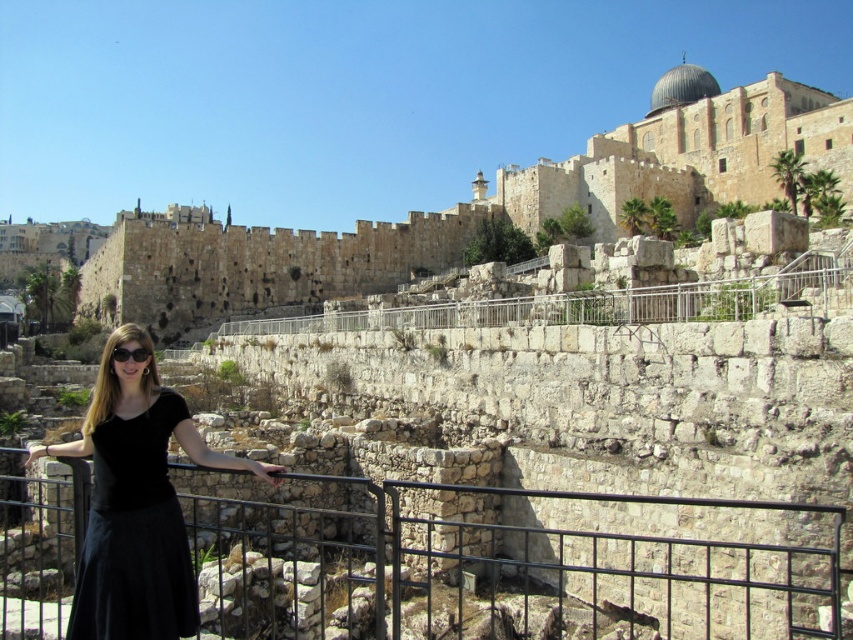
Measure the distance between point (506, 556) and camera.

Point (506, 556) and camera are 45.68 meters apart from each other.

Who is more forward, (328, 636) or (113, 525)?

Point (113, 525)

Who is more distant from viewer, (302, 609) or (273, 467)?

Point (302, 609)

The height and width of the screenshot is (640, 853). In order to click on black metal fence at center in this screenshot , I will do `click(503, 561)`.

Which is more to the left, black velvet dress at center or black plastic goggles at center?

Positioned to the left is black plastic goggles at center.

Between black velvet dress at center and black plastic goggles at center, which one is positioned higher?

Positioned higher is black plastic goggles at center.

Measure the distance between point [192,582] and camera.

Point [192,582] and camera are 92.68 feet apart.

The height and width of the screenshot is (640, 853). I want to click on black velvet dress at center, so click(x=135, y=534).

Between black metal fence at center and black velvet dress at center, which one is positioned higher?

black velvet dress at center is higher up.

Is black metal fence at center shorter than black velvet dress at center?

No, black metal fence at center is not shorter than black velvet dress at center.

You are a GUI agent. You are given a task and a screenshot of the screen. Output one action in this format:
    pyautogui.click(x=<x>, y=<y>)
    Task: Click on the black metal fence at center
    
    Given the screenshot: What is the action you would take?
    pyautogui.click(x=503, y=561)